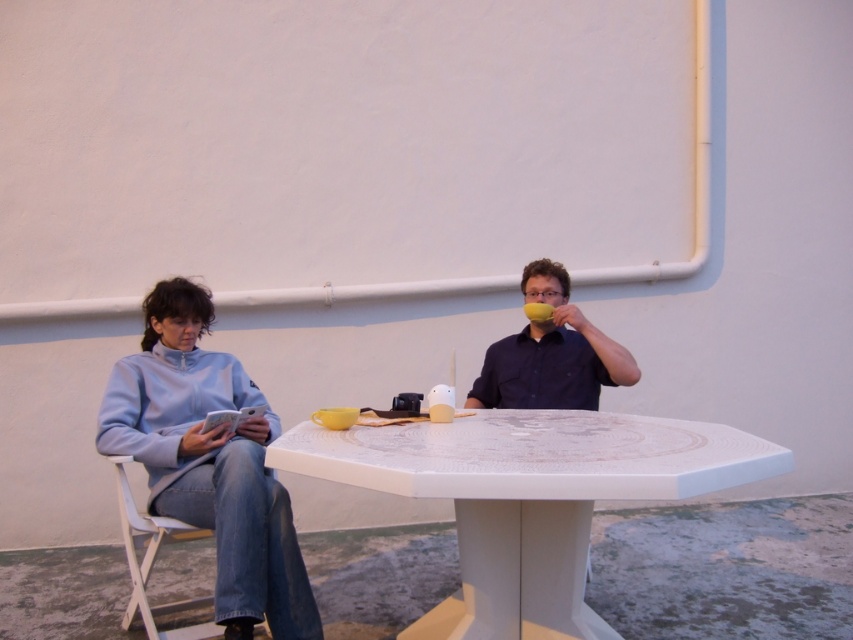
Does light blue fleece jacket at left have a larger size compared to matte yellow cup at upper center?

Yes, light blue fleece jacket at left is bigger than matte yellow cup at upper center.

Can you confirm if light blue fleece jacket at left is positioned to the right of matte yellow cup at upper center?

No, light blue fleece jacket at left is not to the right of matte yellow cup at upper center.

Does point (310, 612) lie behind point (488, 380)?

No, it is not.

I want to click on light blue fleece jacket at left, so click(x=209, y=461).

Who is positioned more to the right, matte yellow cup at upper center or white plastic chair at lower left?

matte yellow cup at upper center is more to the right.

At what (x,y) coordinates should I click in order to perform the action: click on matte yellow cup at upper center. Please return your answer as a coordinate pair (x, y). The width and height of the screenshot is (853, 640). Looking at the image, I should click on (550, 355).

Which is in front, point (556, 339) or point (152, 529)?

Positioned in front is point (152, 529).

Identify the location of matte yellow cup at upper center. (550, 355).

Does white glossy table at center come in front of white plastic chair at lower left?

Yes, it is.

Between white glossy table at center and white plastic chair at lower left, which one appears on the right side from the viewer's perspective?

From the viewer's perspective, white glossy table at center appears more on the right side.

Is point (328, 464) less distant than point (146, 538)?

Yes, it is.

You are a GUI agent. You are given a task and a screenshot of the screen. Output one action in this format:
    pyautogui.click(x=<x>, y=<y>)
    Task: Click on the white glossy table at center
    This screenshot has width=853, height=640.
    Given the screenshot: What is the action you would take?
    pyautogui.click(x=527, y=499)